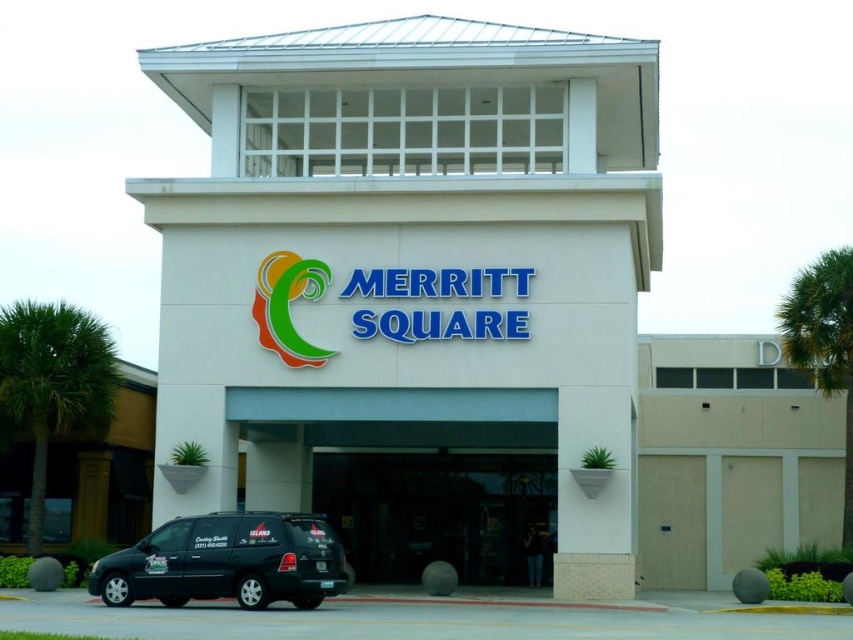
You are standing at the entrance of Merritt Square and want to take a photo of the point at coordinates point (447, 474). The camera you have can focus on objects up to 50 meters away. Will the point be in focus?

The distance of point (447, 474) from camera is 51.61 meters, which is beyond the camera focus limit of 50 meters. The point will not be in focus.

You are a delivery person arriving at the entrance of Merritt Square. You need to enter through the transparent glass door at center. However, your matte black van at lower left is blocking the path. Can you drive the van away without hitting the door?

The transparent glass door at center has a greater height compared to the matte black van at lower left. Since the door is taller, the van can be driven away without hitting the door as long as you ensure clearance based on the van height.